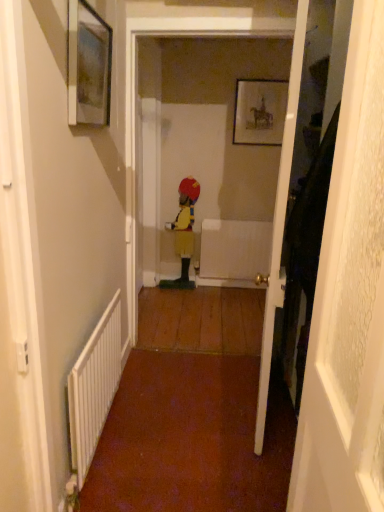
Question: Is wooden door at right, which is the second door from front to back, shorter than white metallic radiator at lower left?

Choices:
 (A) yes
 (B) no

Answer: (B)

Question: Can you confirm if wooden door at right, the first door positioned from the back, is bigger than white metallic radiator at lower left?

Choices:
 (A) no
 (B) yes

Answer: (B)

Question: Is wooden door at right, which is the second door from front to back, smaller than white metallic radiator at lower left?

Choices:
 (A) yes
 (B) no

Answer: (B)

Question: Considering the relative sizes of wooden door at right, the first door positioned from the back, and white metallic radiator at lower left in the image provided, is wooden door at right, the first door positioned from the back, taller than white metallic radiator at lower left?

Choices:
 (A) yes
 (B) no

Answer: (A)

Question: Would you say white metallic radiator at lower left is part of wooden door at right, the first door positioned from the back,'s contents?

Choices:
 (A) yes
 (B) no

Answer: (B)

Question: Is point tap(345, 482) closer or farther from the camera than point tap(269, 329)?

Choices:
 (A) farther
 (B) closer

Answer: (B)

Question: From the image's perspective, is wooden door at right, which is the 2th door in back-to-front order, positioned above or below wooden door at right, the first door positioned from the back?

Choices:
 (A) above
 (B) below

Answer: (B)

Question: Is wooden door at right, acting as the first door starting from the front, situated inside wooden door at right, the first door positioned from the back, or outside?

Choices:
 (A) outside
 (B) inside

Answer: (A)

Question: From a real-world perspective, is wooden door at right, which is the 2th door in back-to-front order, physically located above or below wooden door at right, which is the second door from front to back?

Choices:
 (A) below
 (B) above

Answer: (B)

Question: Based on their positions, is wooden door at right, acting as the first door starting from the front, located to the left or right of matte black picture frame at upper center, positioned as the second picture frame in bottom-to-top order?

Choices:
 (A) left
 (B) right

Answer: (A)

Question: Is wooden door at right, acting as the first door starting from the front, inside the boundaries of matte black picture frame at upper center, the second picture frame from the left, or outside?

Choices:
 (A) inside
 (B) outside

Answer: (B)

Question: Is wooden door at right, which is the 2th door in back-to-front order, taller or shorter than matte black picture frame at upper center, the 1th picture frame in the top-to-bottom sequence?

Choices:
 (A) tall
 (B) short

Answer: (A)

Question: From a real-world perspective, is wooden door at right, which is the 2th door in back-to-front order, physically located above or below matte black picture frame at upper center, the second picture frame from the left?

Choices:
 (A) below
 (B) above

Answer: (A)

Question: Would you say matte black picture frame at upper center, the 1th picture frame when ordered from right to left, is to the left or to the right of matte glass picture frame at upper left, marked as the first picture frame in a bottom-to-top arrangement, in the picture?

Choices:
 (A) left
 (B) right

Answer: (B)

Question: Looking at the image, does matte black picture frame at upper center, which appears as the 2th picture frame when viewed from the front, seem bigger or smaller compared to matte glass picture frame at upper left, the 2th picture frame positioned from the back?

Choices:
 (A) small
 (B) big

Answer: (A)